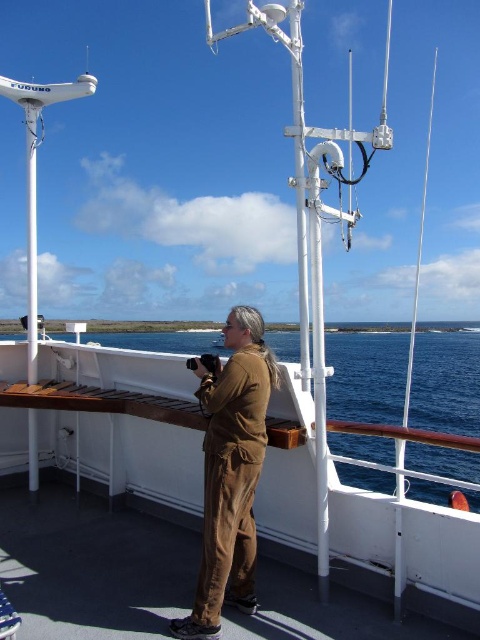
Question: Which point is closer to the camera taking this photo?

Choices:
 (A) (212, 618)
 (B) (361, 404)

Answer: (A)

Question: Does blue water at center lie in front of brown corduroy pants at center?

Choices:
 (A) yes
 (B) no

Answer: (B)

Question: Does blue water at center appear over brown corduroy pants at center?

Choices:
 (A) no
 (B) yes

Answer: (A)

Question: Does blue water at center have a lesser width compared to brown corduroy pants at center?

Choices:
 (A) yes
 (B) no

Answer: (B)